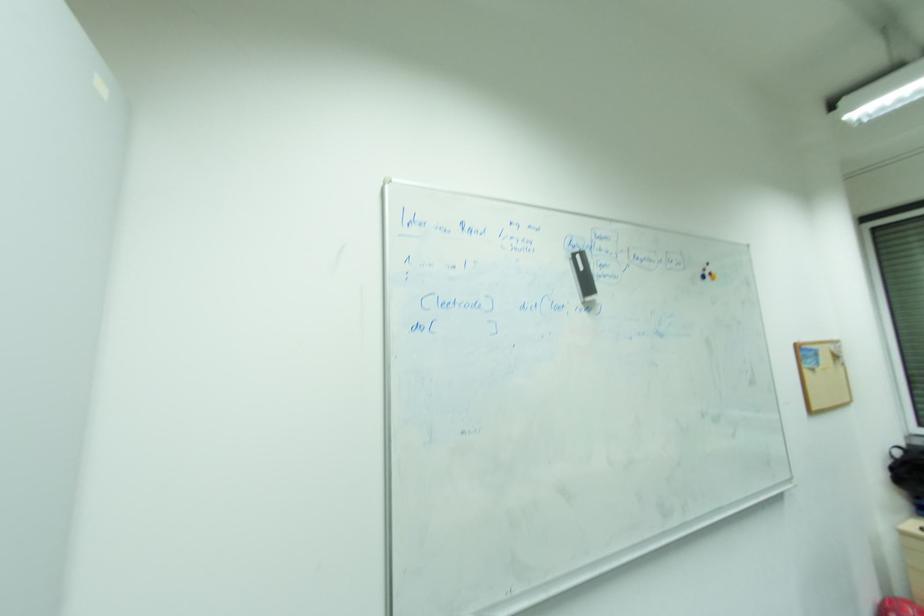
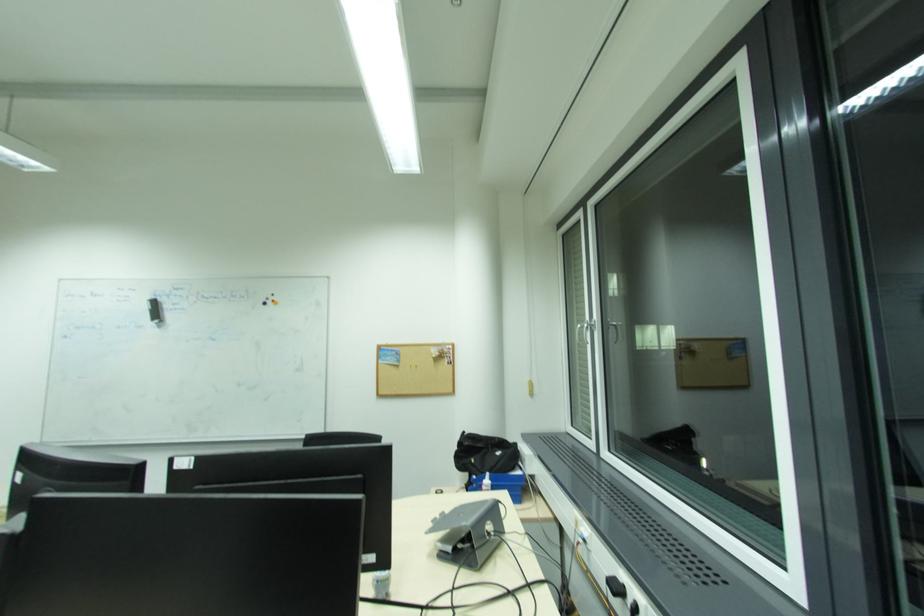
Question: In a continuous first-person perspective shot, in which direction is the camera moving?

Choices:
 (A) Left
 (B) Right
 (C) Forward
 (D) Backward

Answer: (B)